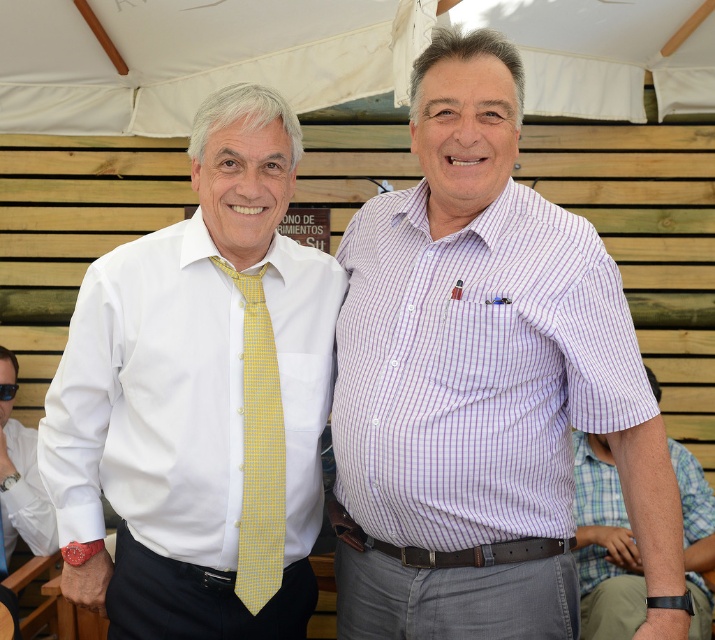
Question: Which of the following is the closest to the observer?

Choices:
 (A) (24, 80)
 (B) (277, 497)
 (C) (246, 448)
 (D) (478, 259)

Answer: (D)

Question: Which object is closer to the camera taking this photo?

Choices:
 (A) purple checkered shirt at center
 (B) white fabric canopy at upper center
 (C) white smooth shirt at center
 (D) white shirt at center

Answer: (C)

Question: Does purple striped shirt at center have a smaller size compared to white fabric canopy at upper center?

Choices:
 (A) yes
 (B) no

Answer: (A)

Question: Which point is farther to the camera?

Choices:
 (A) (686, 502)
 (B) (568, 285)

Answer: (A)

Question: Is white smooth shirt at center positioned in front of purple striped shirt at center?

Choices:
 (A) no
 (B) yes

Answer: (A)

Question: Is white fabric canopy at upper center bigger than yellow dotted fabric tie at center?

Choices:
 (A) yes
 (B) no

Answer: (A)